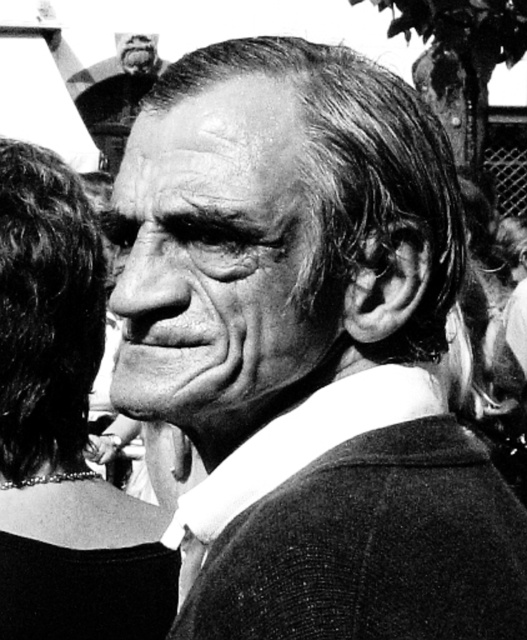
Based on the description, where is the smooth skin face at center located in the image?

The smooth skin face at center is located at the point with coordinates 0.408 and 0.416.

Based on the scene description, which object has a smaller height between the smooth skin face at center and the smooth black hair at left?

The smooth skin face at center has a lesser height compared to the smooth black hair at left.